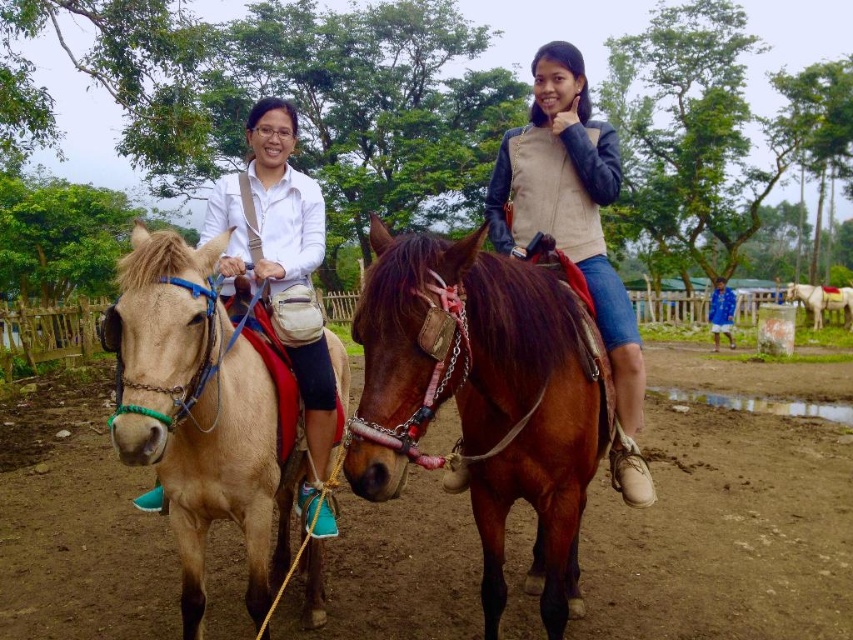
How much distance is there between light brown leather horse at left and blue fabric jacket at lower right?

light brown leather horse at left is 58.31 feet from blue fabric jacket at lower right.

Locate an element on the screen. light brown leather horse at left is located at coordinates (202, 412).

Who is positioned more to the left, light brown leather horse at left or light brown glossy horse at center?

light brown leather horse at left

Which is in front, point (193, 451) or point (805, 288)?

Point (193, 451)

Between point (248, 374) and point (811, 304), which one is positioned in front?

Point (248, 374)

I want to click on light brown leather horse at left, so click(x=202, y=412).

Can you confirm if brown glossy horse at center is taller than light brown glossy horse at center?

No.

Measure the distance between point (555, 337) and camera.

Point (555, 337) is 7.74 feet from camera.

I want to click on brown glossy horse at center, so click(x=485, y=397).

I want to click on brown glossy horse at center, so click(485, 397).